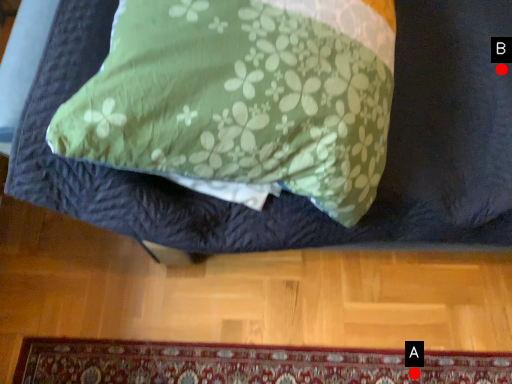
Question: Two points are circled on the image, labeled by A and B beside each circle. Which of the following is the closest to the observer?

Choices:
 (A) A is closer
 (B) B is closer

Answer: (B)